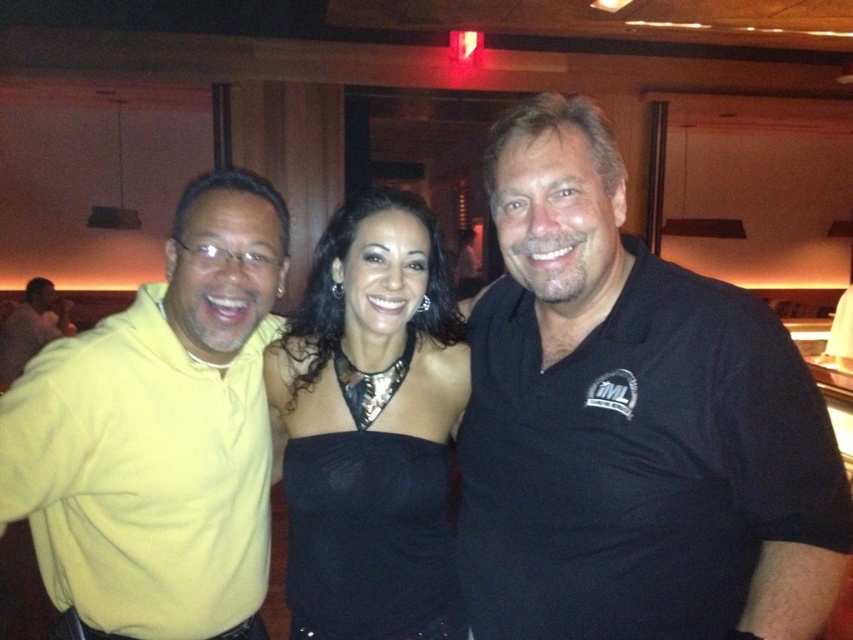
Can you confirm if black cotton shirt at right is positioned below yellow matte shirt at left?

Correct, black cotton shirt at right is located below yellow matte shirt at left.

How far apart are black cotton shirt at right and yellow matte shirt at left?

black cotton shirt at right is 13.85 feet away from yellow matte shirt at left.

At what (x,y) coordinates should I click in order to perform the action: click on black cotton shirt at right. Please return your answer as a coordinate pair (x, y). Looking at the image, I should click on (630, 422).

I want to click on black cotton shirt at right, so click(x=630, y=422).

Is black satin dress at center thinner than yellow matte shirt at left?

Indeed, black satin dress at center has a lesser width compared to yellow matte shirt at left.

Is point (343, 525) farther from viewer compared to point (45, 321)?

No.

The image size is (853, 640). Describe the element at coordinates (370, 428) in the screenshot. I see `black satin dress at center` at that location.

The width and height of the screenshot is (853, 640). I want to click on black satin dress at center, so click(370, 428).

Is black cotton shirt at right taller than black satin dress at center?

Indeed, black cotton shirt at right has a greater height compared to black satin dress at center.

Is black cotton shirt at right wider than black satin dress at center?

Correct, the width of black cotton shirt at right exceeds that of black satin dress at center.

Find the location of a particular element. black cotton shirt at right is located at coordinates (630, 422).